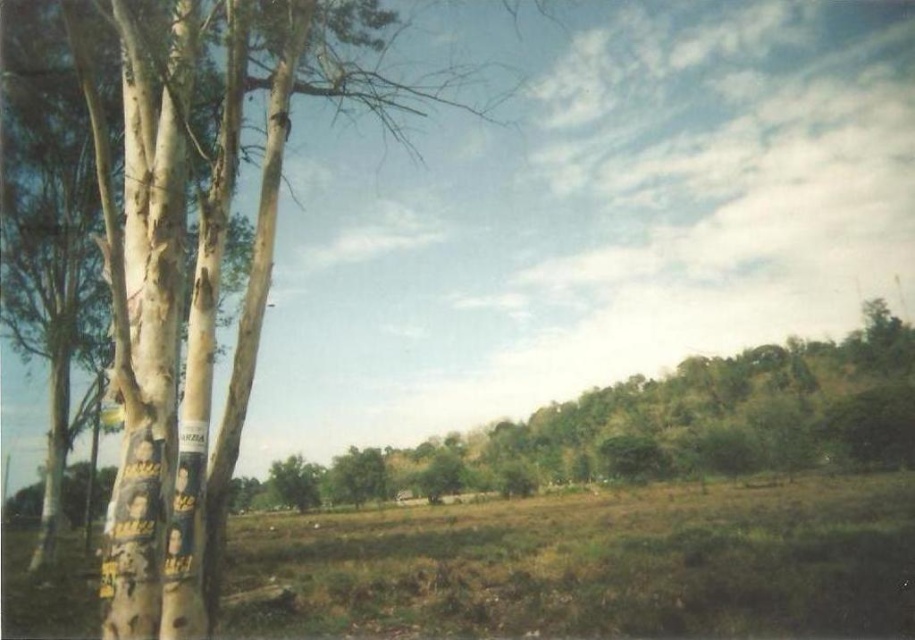
What do you see at coordinates (202, 273) in the screenshot? The width and height of the screenshot is (915, 640). I see `white rough bark tree at left` at bounding box center [202, 273].

Who is positioned more to the right, white rough bark tree at left or green leafy tree at center?

green leafy tree at center

Between point (113, 12) and point (790, 360), which one is positioned behind?

Positioned behind is point (790, 360).

Where is `white rough bark tree at left`? The image size is (915, 640). white rough bark tree at left is located at coordinates (202, 273).